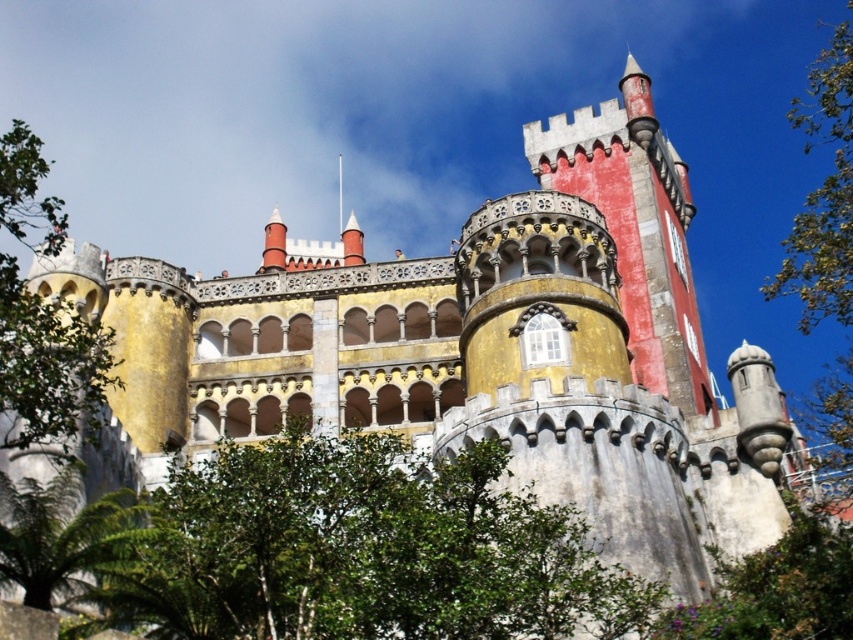
Question: Which point appears farthest from the camera in this image?

Choices:
 (A) (68, 344)
 (B) (386, 576)
 (C) (816, 563)

Answer: (C)

Question: Does green leafy tree at left appear on the right side of green leafy tree at lower right?

Choices:
 (A) yes
 (B) no

Answer: (B)

Question: Considering the real-world distances, which object is closest to the green leafy tree at left?

Choices:
 (A) green leafy tree at lower center
 (B) green leafy tree at right

Answer: (A)

Question: Is green leafy tree at right to the right of green leafy tree at lower right from the viewer's perspective?

Choices:
 (A) no
 (B) yes

Answer: (B)

Question: Considering the real-world distances, which object is farthest from the green leafy tree at left?

Choices:
 (A) green leafy tree at lower center
 (B) green leafy tree at lower right

Answer: (B)

Question: Does green leafy tree at left appear under green leafy tree at lower right?

Choices:
 (A) no
 (B) yes

Answer: (A)